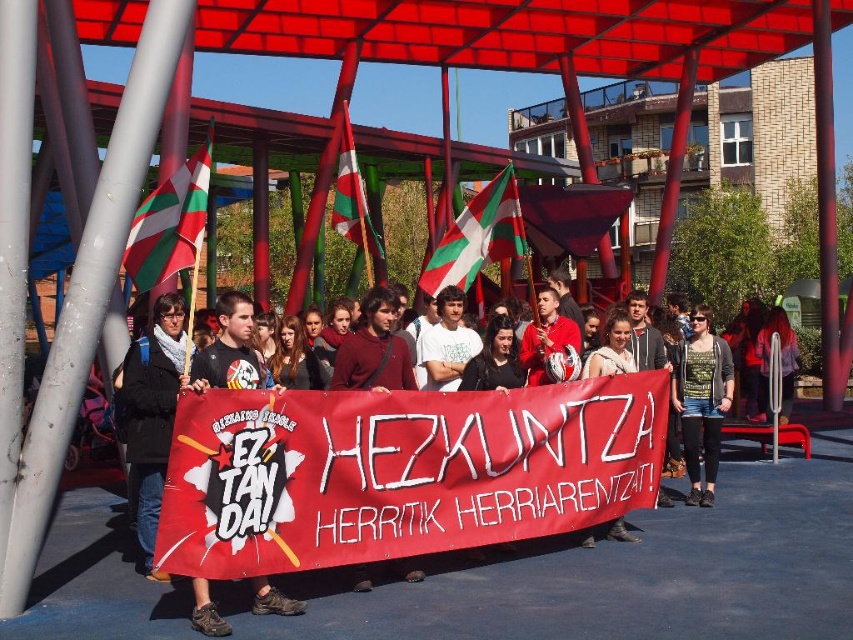
Does matte black jacket at center have a larger size compared to green printed shirt at center?

Yes, matte black jacket at center is bigger than green printed shirt at center.

How much distance is there between matte black jacket at center and green printed shirt at center?

They are 12.18 meters apart.

Where is `matte black jacket at center`? The height and width of the screenshot is (640, 853). matte black jacket at center is located at coordinates (386, 465).

Where is `matte black jacket at center`? The width and height of the screenshot is (853, 640). matte black jacket at center is located at coordinates (386, 465).

Who is lower down, black fabric jacket at center or green-white-red striped flag at left?

black fabric jacket at center is lower down.

What do you see at coordinates (154, 412) in the screenshot?
I see `black fabric jacket at center` at bounding box center [154, 412].

Where is `black fabric jacket at center`? The height and width of the screenshot is (640, 853). black fabric jacket at center is located at coordinates (x=154, y=412).

Which is more to the right, green-white-red striped flag at left or green and white striped fabric at center?

green and white striped fabric at center is more to the right.

Is green-white-red striped flag at left to the right of green and white striped fabric at center from the viewer's perspective?

In fact, green-white-red striped flag at left is to the left of green and white striped fabric at center.

Where is `green-white-red striped flag at left`? The image size is (853, 640). green-white-red striped flag at left is located at coordinates (170, 224).